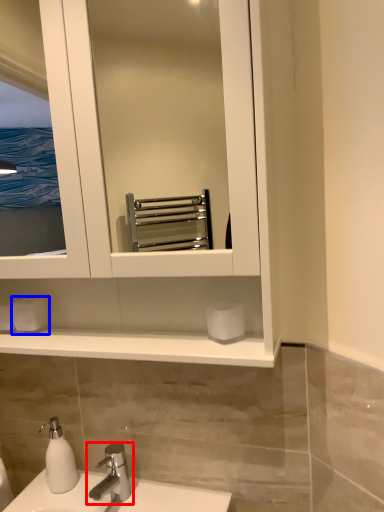
Question: Which of the following is the farthest to the observer, tap (highlighted by a red box) or toilet paper (highlighted by a blue box)?

Choices:
 (A) tap
 (B) toilet paper

Answer: (B)